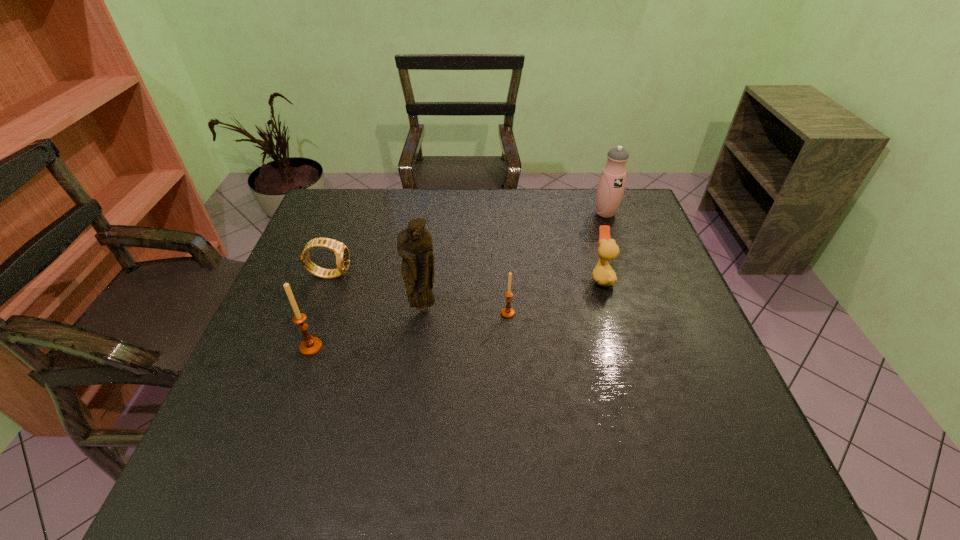
The width and height of the screenshot is (960, 540). Find the location of `free space between the taller candle_holder and the shorter candle_holder`. free space between the taller candle_holder and the shorter candle_holder is located at coordinates (409, 330).

Where is `vacant area between the watch and the duck`? vacant area between the watch and the duck is located at coordinates (466, 275).

Where is `vacant space that's between the figurine and the third object from right to left`? vacant space that's between the figurine and the third object from right to left is located at coordinates (466, 310).

Where is `free spot between the fifth object from left to right and the taller candle_holder`? free spot between the fifth object from left to right and the taller candle_holder is located at coordinates (456, 312).

Find the location of a particular element. free space between the figurine and the duck is located at coordinates (513, 293).

Identify the location of vacant region between the watch and the nearer candle_holder. (321, 310).

Find the location of `vacant space in between the farther candle_holder and the nearer candle_holder`. vacant space in between the farther candle_holder and the nearer candle_holder is located at coordinates (409, 330).

At what (x,y) coordinates should I click in order to perform the action: click on vacant area that lies between the left candle_holder and the shorter candle_holder. Please return your answer as a coordinate pair (x, y). The width and height of the screenshot is (960, 540). Looking at the image, I should click on (409, 330).

At what (x,y) coordinates should I click in order to perform the action: click on object that ranks as the second closest to the watch. Please return your answer as a coordinate pair (x, y). Image resolution: width=960 pixels, height=540 pixels. Looking at the image, I should click on (310, 346).

You are a GUI agent. You are given a task and a screenshot of the screen. Output one action in this format:
    pyautogui.click(x=<x>, y=<y>)
    Task: Click on the object that can be found as the second closest to the nearest object
    
    Given the screenshot: What is the action you would take?
    pyautogui.click(x=414, y=244)